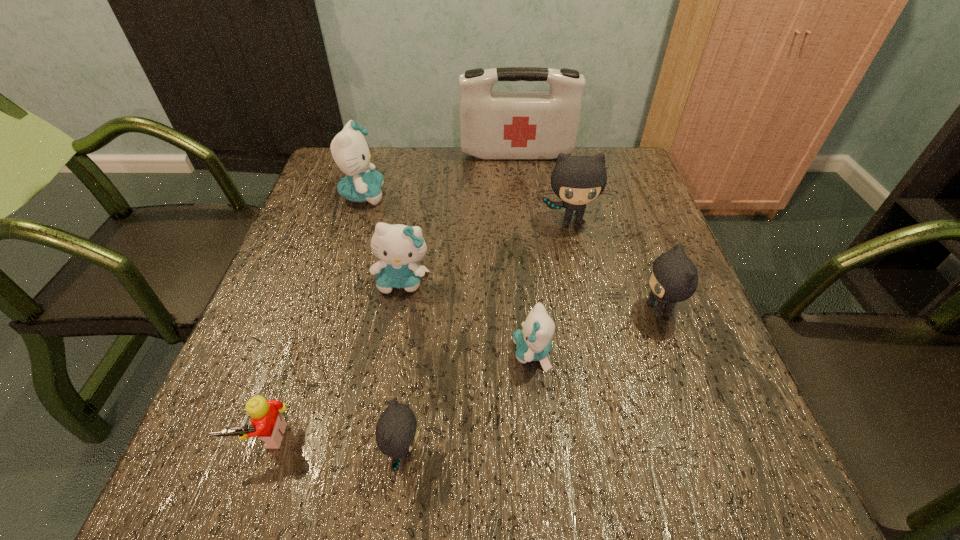
This screenshot has height=540, width=960. I want to click on the smallest blue kitten, so click(533, 342).

Find the location of a particular element. This screenshot has width=960, height=540. the nearest blue kitten is located at coordinates (533, 342).

This screenshot has height=540, width=960. What are the coordinates of `Lego` in the screenshot? It's located at (268, 424).

Identify the location of the smallest gray kitten. (396, 432).

Find the location of `the nearest gray kitten`. the nearest gray kitten is located at coordinates (396, 432).

This screenshot has width=960, height=540. What are the coordinates of `vacant region located on the front side of the first-aid kit` in the screenshot? It's located at (526, 234).

Where is `free space located on the face of the leftmost kitten`? This screenshot has width=960, height=540. free space located on the face of the leftmost kitten is located at coordinates (460, 195).

The width and height of the screenshot is (960, 540). What are the coordinates of `vacant space situated 0.120m on the front-facing side of the biggest gray kitten` in the screenshot? It's located at (582, 269).

Find the location of a particular element. The image size is (960, 540). free space located on the face of the second smallest blue kitten is located at coordinates (391, 353).

The image size is (960, 540). Find the location of `free region located 0.370m on the front-facing side of the second biggest gray kitten`. free region located 0.370m on the front-facing side of the second biggest gray kitten is located at coordinates click(x=459, y=310).